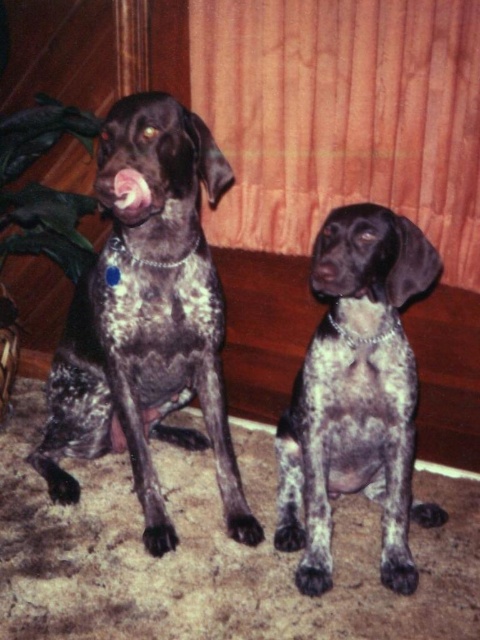
Who is more forward, (x=94, y=336) or (x=321, y=278)?

Point (x=321, y=278)

Can you confirm if speckled fur dog at left is positioned to the right of speckled fur dog at center?

No, speckled fur dog at left is not to the right of speckled fur dog at center.

Find the location of `speckled fur dog at left`. speckled fur dog at left is located at coordinates (146, 317).

In order to click on speckled fur dog at left in this screenshot , I will do `click(146, 317)`.

Which of these two, speckled fur dog at left or green matte plant at left, stands taller?

speckled fur dog at left

Which is above, speckled fur dog at left or green matte plant at left?

Positioned higher is green matte plant at left.

Image resolution: width=480 pixels, height=640 pixels. In order to click on speckled fur dog at left in this screenshot , I will do `click(146, 317)`.

The width and height of the screenshot is (480, 640). What are the coordinates of `speckled fur dog at center` in the screenshot? It's located at (356, 394).

Who is taller, speckled fur dog at center or green matte plant at left?

speckled fur dog at center

This screenshot has height=640, width=480. What do you see at coordinates (356, 394) in the screenshot?
I see `speckled fur dog at center` at bounding box center [356, 394].

At what (x,y) coordinates should I click in order to perform the action: click on speckled fur dog at center. Please return your answer as a coordinate pair (x, y). This screenshot has width=480, height=640. Looking at the image, I should click on (356, 394).